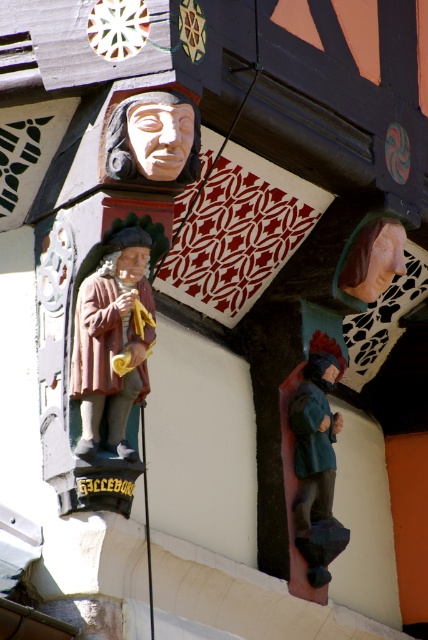
What do you see at coordinates (112, 340) in the screenshot? The width and height of the screenshot is (428, 640). I see `wooden statue at left` at bounding box center [112, 340].

Measure the distance between point (74, 385) and camera.

208.03 feet

Find the location of `wooden statue at left`. wooden statue at left is located at coordinates (112, 340).

Is the position of wooden figure at lower right more distant than that of wooden carving at upper center?

Yes, it is behind wooden carving at upper center.

Between point (309, 400) and point (142, 122), which one is positioned in front?

Point (142, 122) is more forward.

Identify the location of wooden figure at lower right. This screenshot has width=428, height=640. (317, 460).

Does wooden statue at left have a greater height compared to wooden carving at upper center?

Correct, wooden statue at left is much taller as wooden carving at upper center.

Does point (118, 348) come farther from viewer compared to point (162, 102)?

Yes, it is.

Find the location of a particular element. wooden statue at left is located at coordinates coord(112,340).